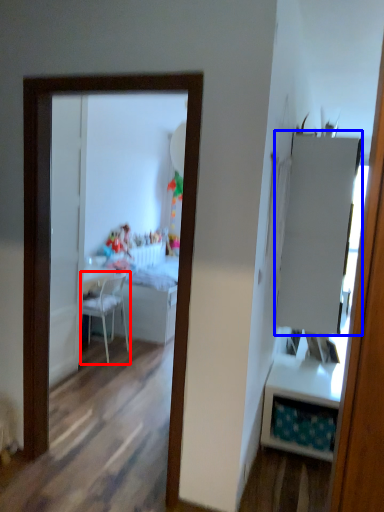
Question: Which object is further to the camera taking this photo, chair (highlighted by a red box) or armoire (highlighted by a blue box)?

Choices:
 (A) chair
 (B) armoire

Answer: (A)